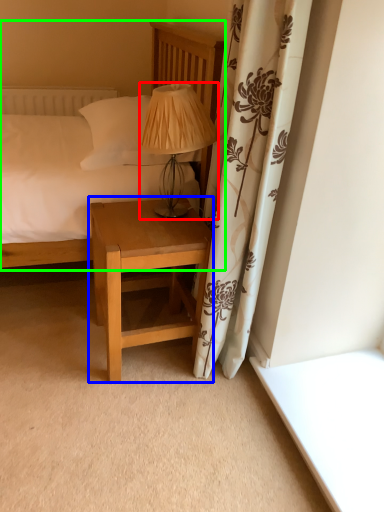
Question: Estimate the real-world distances between objects in this image. Which object is closer to table lamp (highlighted by a red box), nightstand (highlighted by a blue box) or bed (highlighted by a green box)?

Choices:
 (A) nightstand
 (B) bed

Answer: (B)